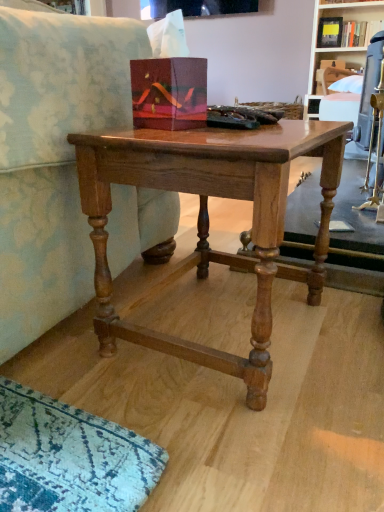
Where is `free spot to the right of shiny brown wood table at center`? The width and height of the screenshot is (384, 512). free spot to the right of shiny brown wood table at center is located at coordinates (342, 332).